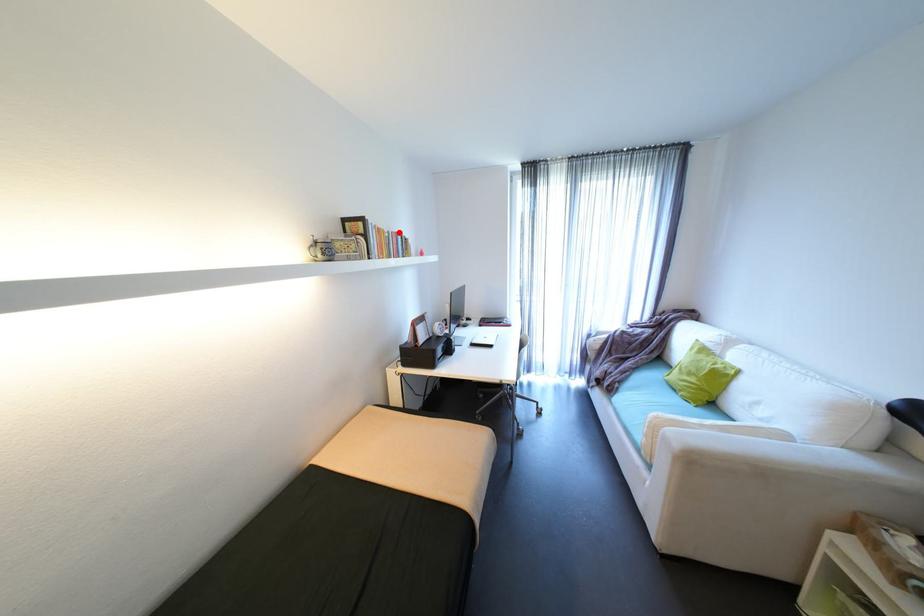
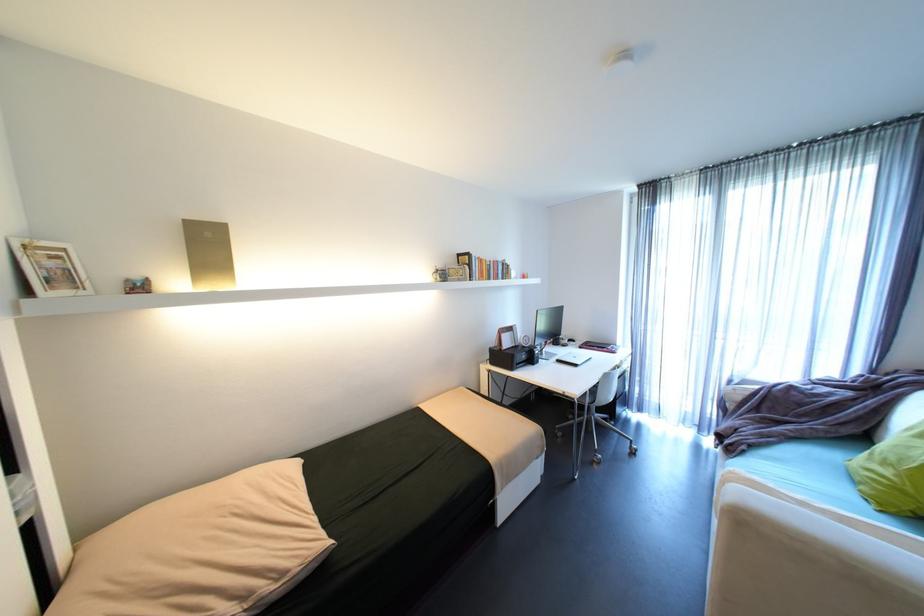
Find the pixel in the second image that matches the highlighted location in the first image.

(500, 262)